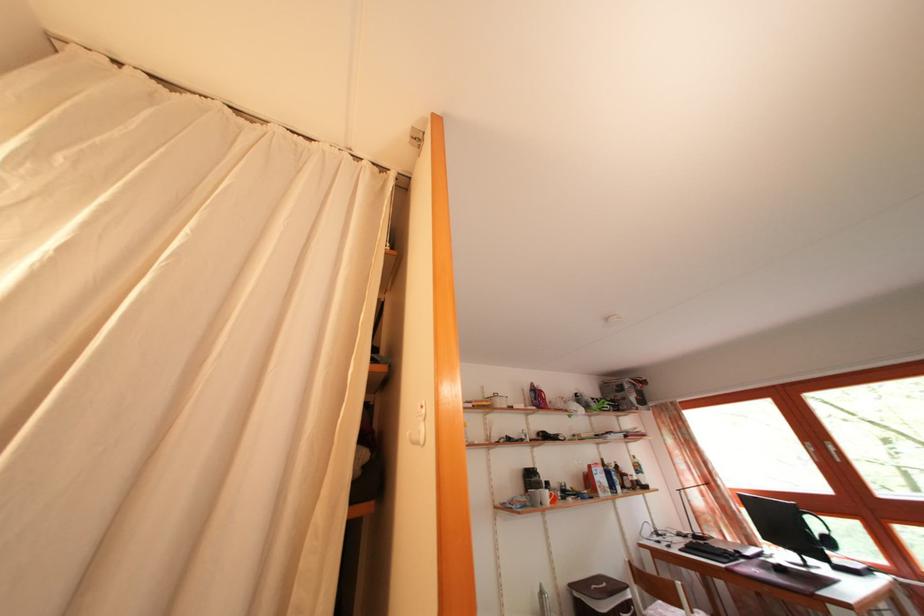
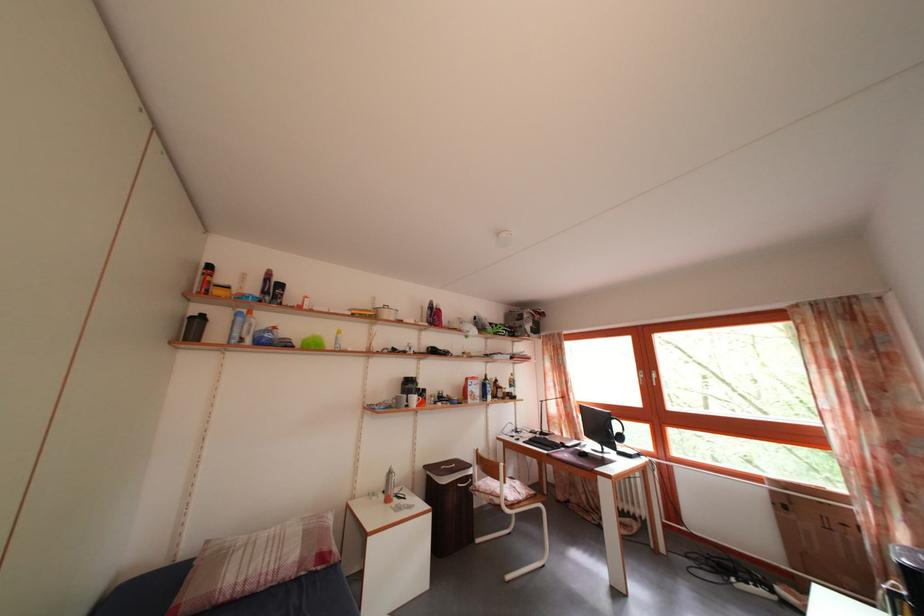
Where in the second image is the point corresponding to the point at 703,544 from the first image?

(550, 440)